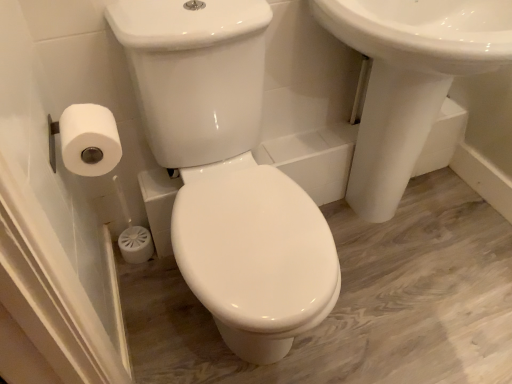
You are a GUI agent. You are given a task and a screenshot of the screen. Output one action in this format:
    pyautogui.click(x=<x>, y=<y>)
    Task: Click on the vacant area that lies in front of white glossy sink at upper right
    
    Given the screenshot: What is the action you would take?
    pyautogui.click(x=431, y=321)